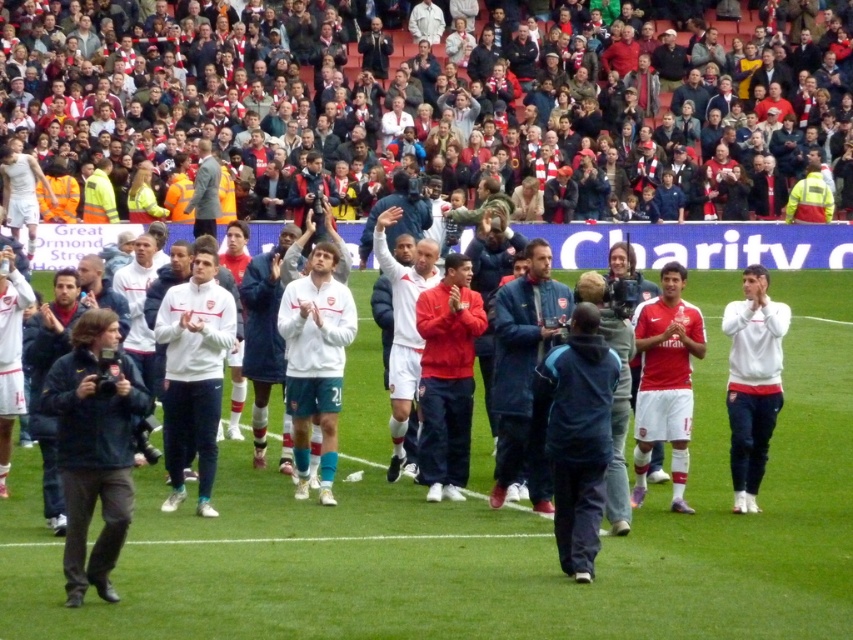
Question: Which point is farther to the camera?

Choices:
 (A) click(553, 321)
 (B) click(57, 68)

Answer: (B)

Question: Which point is closer to the camera?

Choices:
 (A) white matte jacket at center
 (B) red scarf at upper center

Answer: (A)

Question: Can you confirm if red scarf at upper center is wider than blue fabric jacket at center?

Choices:
 (A) yes
 (B) no

Answer: (A)

Question: Is red scarf at upper center behind blue fabric jacket at center?

Choices:
 (A) yes
 (B) no

Answer: (A)

Question: Does red scarf at upper center have a larger size compared to blue fabric jacket at center?

Choices:
 (A) no
 (B) yes

Answer: (B)

Question: Which object appears farthest from the camera in this image?

Choices:
 (A) blue fabric jacket at center
 (B) red scarf at upper center

Answer: (B)